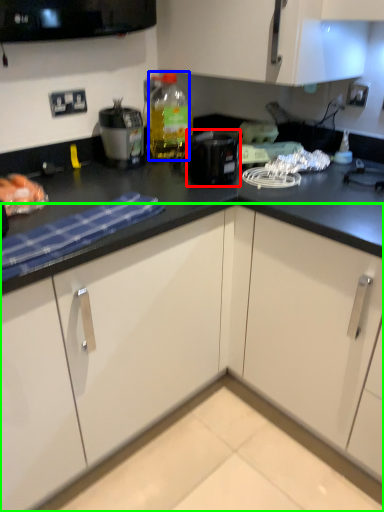
Question: Based on their relative distances, which object is farther from kitchen appliance (highlighted by a red box)? Choose from bottle (highlighted by a blue box) and cabinetry (highlighted by a green box).

Choices:
 (A) bottle
 (B) cabinetry

Answer: (B)